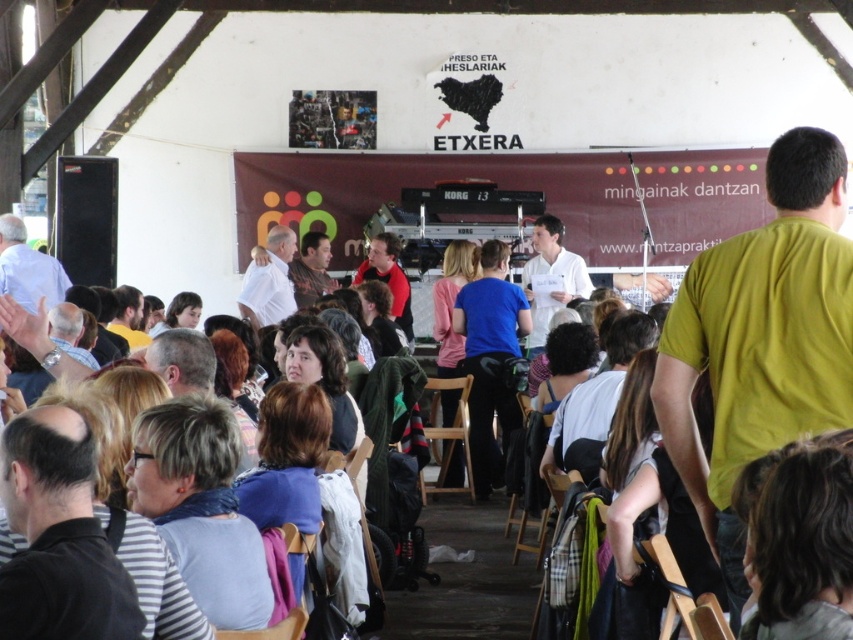
Question: Does blue matte shirt at center appear on the left side of wooden chair at center?

Choices:
 (A) no
 (B) yes

Answer: (A)

Question: Among these points, which one is nearest to the camera?

Choices:
 (A) (467, 429)
 (B) (799, 218)

Answer: (B)

Question: Is the position of blue matte shirt at center more distant than that of wooden chair at center?

Choices:
 (A) yes
 (B) no

Answer: (A)

Question: Which of the following is the closest to the observer?

Choices:
 (A) (512, 420)
 (B) (440, 387)
 (C) (834, 298)

Answer: (C)

Question: Which point appears closest to the camera in this image?

Choices:
 (A) (473, 490)
 (B) (505, 307)

Answer: (A)

Question: Is green t-shirt at right wider than wooden chair at center?

Choices:
 (A) yes
 (B) no

Answer: (A)